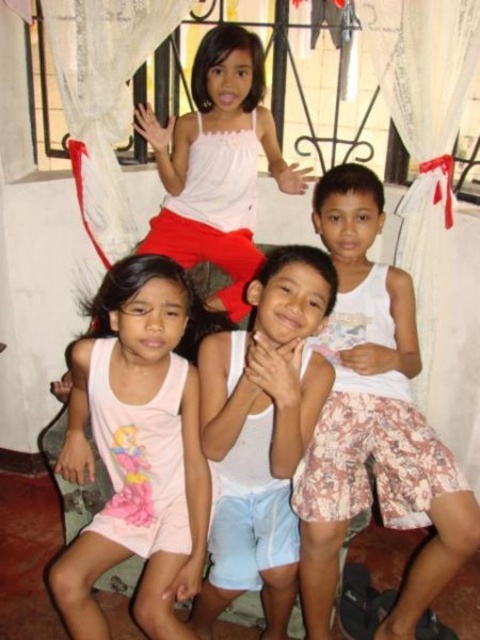
Question: In this image, where is white cotton tank top at center located relative to pink cotton dress at lower left?

Choices:
 (A) right
 (B) left

Answer: (A)

Question: Does pink cotton dress at lower left have a smaller size compared to white matte tank top at upper center?

Choices:
 (A) yes
 (B) no

Answer: (A)

Question: Among these objects, which one is nearest to the camera?

Choices:
 (A) white cotton tank top at center
 (B) white matte tank top at upper center
 (C) white cotton shirt at center
 (D) pink cotton dress at lower left

Answer: (C)

Question: Which of these objects is positioned farthest from the white cotton shirt at center?

Choices:
 (A) white cotton tank top at center
 (B) pink cotton dress at lower left

Answer: (A)

Question: Among these objects, which one is farthest from the camera?

Choices:
 (A) white cotton shirt at center
 (B) white matte tank top at upper center

Answer: (B)

Question: Can you confirm if pink cotton dress at lower left is positioned to the right of white matte tank top at upper center?

Choices:
 (A) yes
 (B) no

Answer: (B)